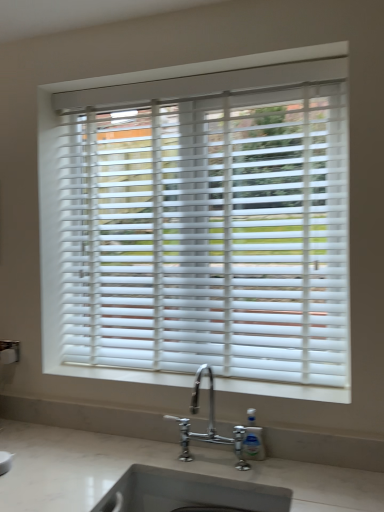
Identify the location of spots to the right of chrome metallic faucet at lower center. (281, 470).